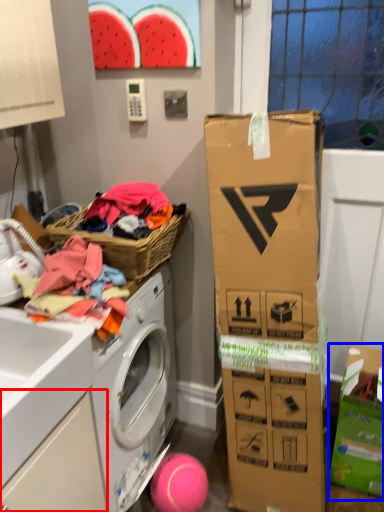
Question: Among these objects, which one is farthest to the camera, drawer (highlighted by a red box) or cardboard box (highlighted by a blue box)?

Choices:
 (A) drawer
 (B) cardboard box

Answer: (B)